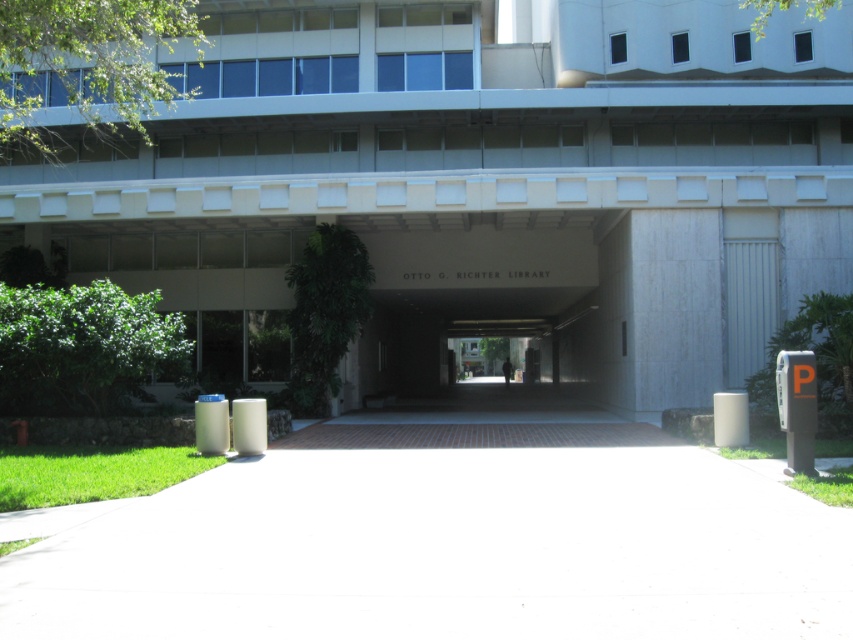
You are standing at the entrance of the Otto G. Richter Library and want to locate the white concrete parking garage at center. According to the coordinates provided, where should you look to find it?

The white concrete parking garage at center is located at point (479,182).

You are standing at the entrance of the Otto G. Richter Library and need to determine which structure is taller between the white concrete parking garage at center and the white concrete pavement at lower center. Based on the scene, which one is taller?

The white concrete parking garage at center is taller than the white concrete pavement at lower center.

You are standing at the entrance of the Otto G. Richter Library and want to reach the point marked as point (653,120). If your walking speed is 1.5 meters per second, how many seconds will it take you to reach that point?

The point (653,120) is 29.10 meters away from the camera. At a walking speed of 1.5 meters per second, it would take 29.10 divided by 1.5, which equals approximately 19.4 seconds to reach the point.